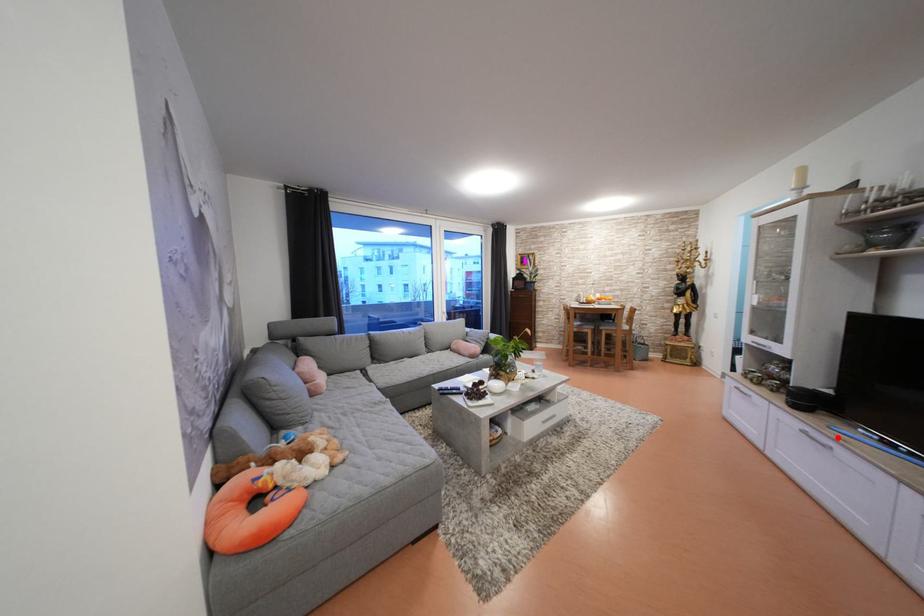
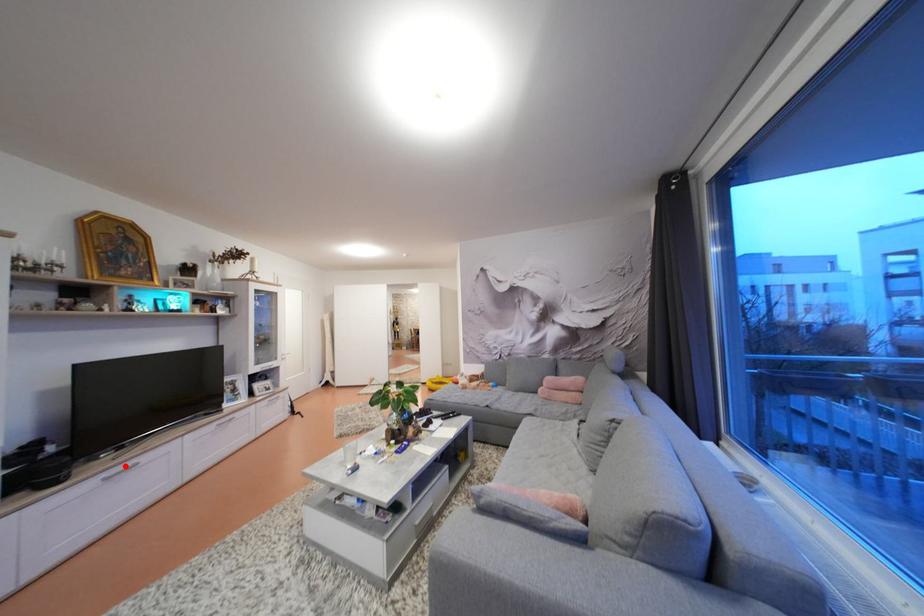
I am providing you with two images of the same scene from different viewpoints. A red point is marked on the first image and another point is marked on the second image. Is the red point in image1 aligned with the point shown in image2?

Yes